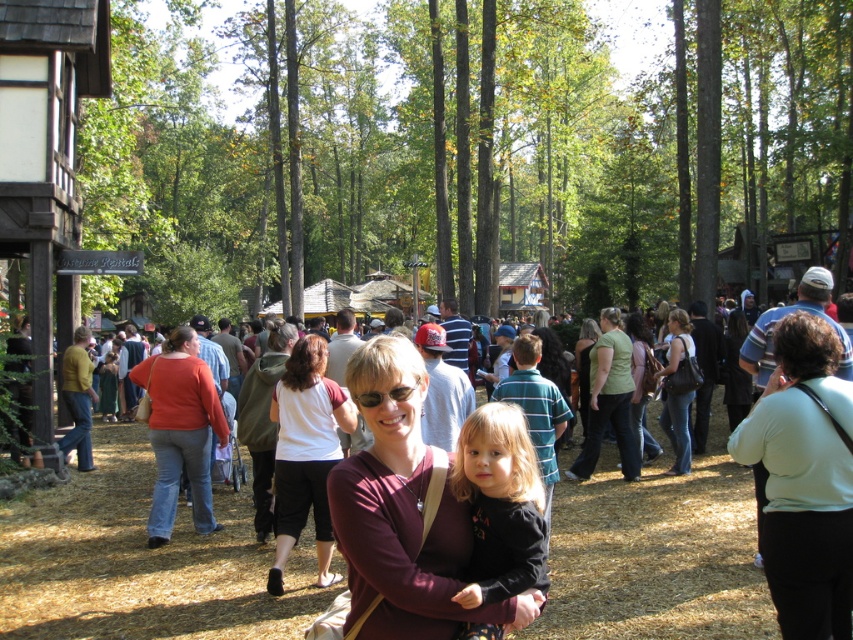
You are a photographer trying to capture the light green fabric at center and the white cotton shirt at center in the same frame. Which object should you focus on first to ensure both are in focus?

You should focus on the light green fabric at center first since it is closer to the viewer than the white cotton shirt at center, allowing the camera to adjust the depth of field to include both.

You are standing at the center of the image and see the point labeled as point (403, 512). What object is located at that point?

The point (403, 512) is where the maroon fabric shirt at center is located.

Based on the photo, you are a photographer positioned at the camera location. You want to capture a closeup shot of the matte red shirt at center. Considering the distance, what is the minimum focal length required to fill the frame with the shirt?

The matte red shirt at center is 8.28 meters away from the camera. To fill the frame with the shirt, you would need a focal length of at least 200mm, assuming a full frame sensor and a subject size of approximately 0.5 meters in height.